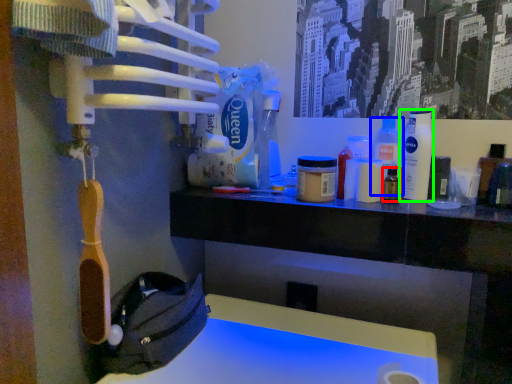
Question: Based on their relative distances, which object is farther from bottle (highlighted by a red box)? Choose from cleaning product (highlighted by a blue box) and bottle (highlighted by a green box).

Choices:
 (A) cleaning product
 (B) bottle

Answer: (B)